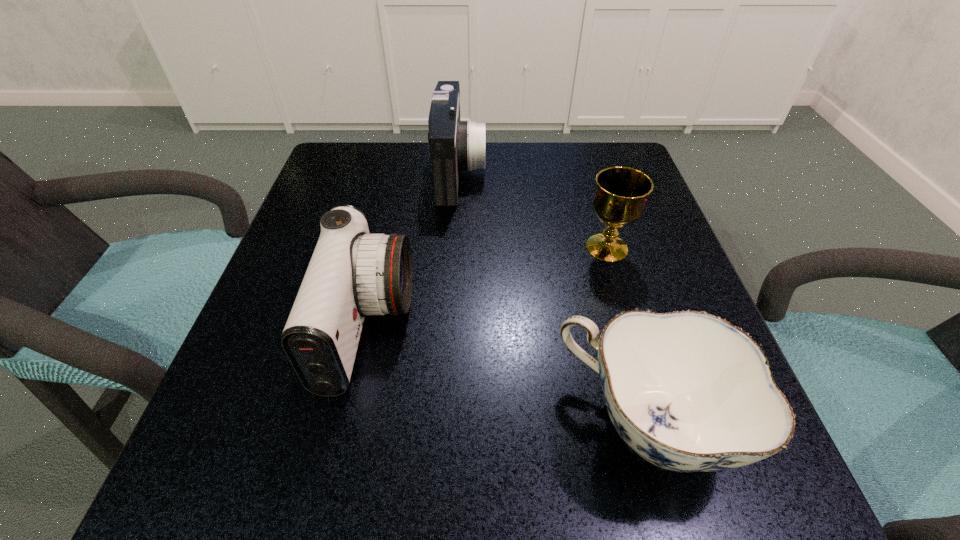
This screenshot has height=540, width=960. I want to click on object that is at the far edge, so click(x=455, y=146).

At what (x,y) coordinates should I click in order to perform the action: click on object located at the near edge. Please return your answer as a coordinate pair (x, y). Looking at the image, I should click on (687, 391).

Locate an element on the screen. object at the left edge is located at coordinates (352, 273).

Identify the location of chalice located in the right edge section of the desktop. (621, 194).

You are a GUI agent. You are given a task and a screenshot of the screen. Output one action in this format:
    pyautogui.click(x=<x>, y=<y>)
    Task: Click on the chinaware located in the right edge section of the desktop
    This screenshot has height=540, width=960.
    Given the screenshot: What is the action you would take?
    pyautogui.click(x=687, y=391)

Find the location of a particular element. object that is at the near right corner is located at coordinates (687, 391).

This screenshot has width=960, height=540. Identify the location of free spot at the far edge of the desktop. (404, 148).

Where is `vacant position at the near edge of the desktop`? The width and height of the screenshot is (960, 540). vacant position at the near edge of the desktop is located at coordinates (515, 444).

Locate an element on the screen. The height and width of the screenshot is (540, 960). vacant space at the left edge of the desktop is located at coordinates (250, 389).

Locate an element on the screen. vacant region at the right edge of the desktop is located at coordinates (612, 307).